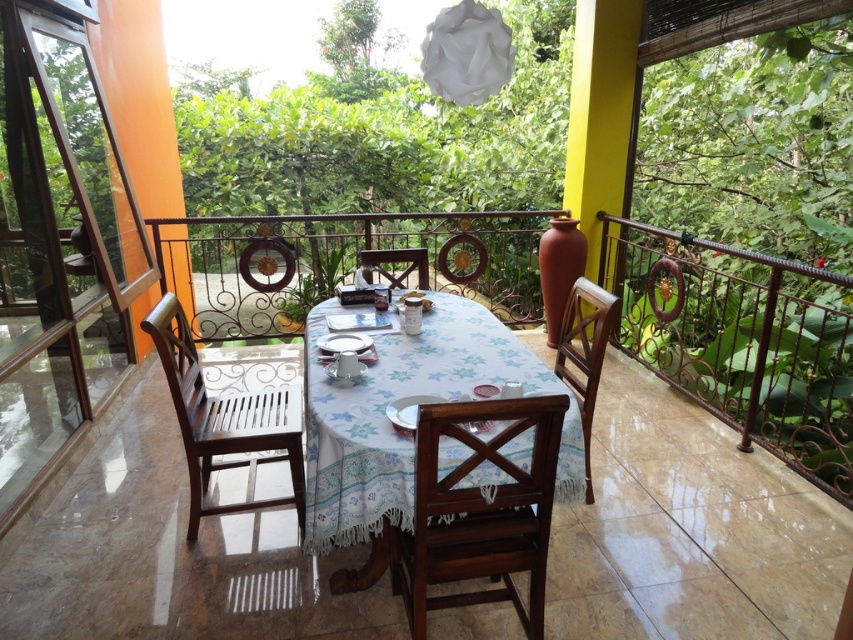
Which is in front, point (416, 477) or point (422, 252)?

Positioned in front is point (416, 477).

Measure the distance between point (532, 632) and camera.

Point (532, 632) and camera are 6.12 feet apart.

The width and height of the screenshot is (853, 640). What are the coordinates of `mahogany wood chair at center` in the screenshot? It's located at (479, 509).

Is white floral tablecloth at center positioned behind wooden chair at center?

That is False.

Who is higher up, white floral tablecloth at center or wooden chair at center?

wooden chair at center is above.

This screenshot has width=853, height=640. What are the coordinates of `white floral tablecloth at center` in the screenshot? It's located at (390, 424).

Identify the location of white floral tablecloth at center. (390, 424).

Who is more distant from viewer, (281,502) or (424,269)?

Point (424,269)

Is point (187, 467) in front of point (396, 285)?

That is True.

Image resolution: width=853 pixels, height=640 pixels. I want to click on brown wooden chair at left, so click(223, 419).